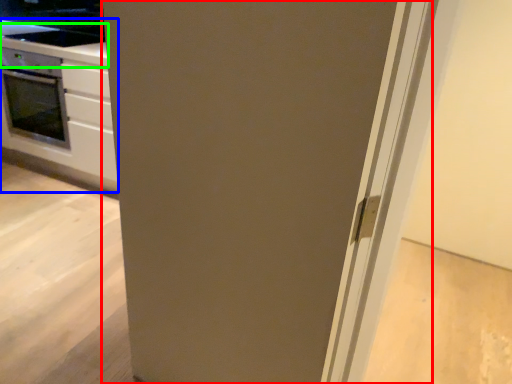
Question: Estimate the real-world distances between objects in this image. Which object is closer to door (highlighted by a red box), cabinetry (highlighted by a blue box) or counter top (highlighted by a green box)?

Choices:
 (A) cabinetry
 (B) counter top

Answer: (A)